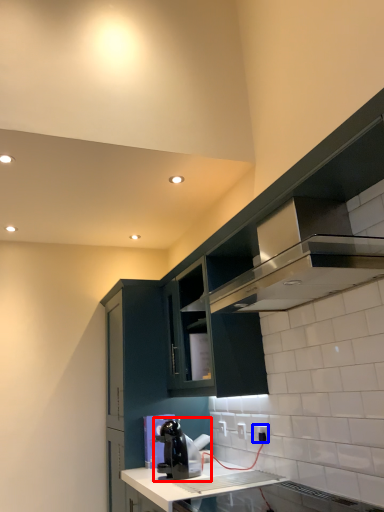
Question: Which of the following is the closest to the observer, home appliance (highlighted by a red box) or electric outlet (highlighted by a blue box)?

Choices:
 (A) home appliance
 (B) electric outlet

Answer: (A)